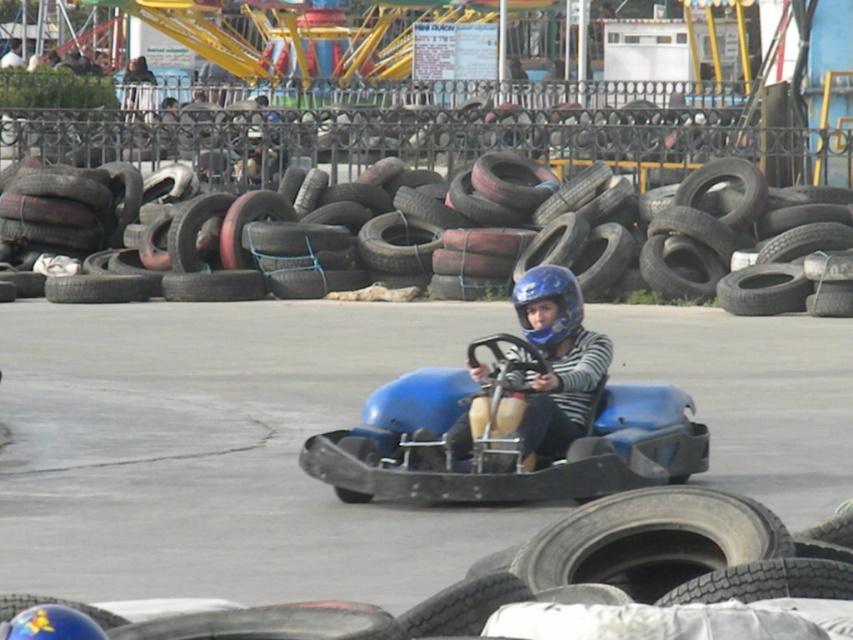
Question: Among these points, which one is farthest from the camera?

Choices:
 (A) (653, 433)
 (B) (560, 266)
 (C) (711, 522)

Answer: (B)

Question: Which object is the closest to the blue matte go-kart at center?

Choices:
 (A) black rubber tire at lower right
 (B) black rubber tire at center
 (C) blue matte helmet at center

Answer: (C)

Question: Is blue matte go-kart at center below blue matte helmet at center?

Choices:
 (A) no
 (B) yes

Answer: (B)

Question: Can you confirm if blue matte go-kart at center is positioned to the right of blue matte helmet at center?

Choices:
 (A) no
 (B) yes

Answer: (A)

Question: Is black rubber tire at center to the left of blue matte helmet at center from the viewer's perspective?

Choices:
 (A) yes
 (B) no

Answer: (B)

Question: Which of the following is the farthest from the observer?

Choices:
 (A) black rubber tire at center
 (B) blue matte go-kart at center
 (C) blue matte helmet at center

Answer: (A)